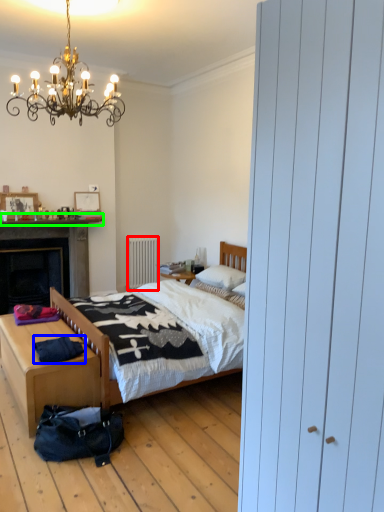
Question: Based on their relative distances, which object is farther from radiator (highlighted by a red box)? Choose from clothing (highlighted by a blue box) and mantle (highlighted by a green box).

Choices:
 (A) clothing
 (B) mantle

Answer: (A)